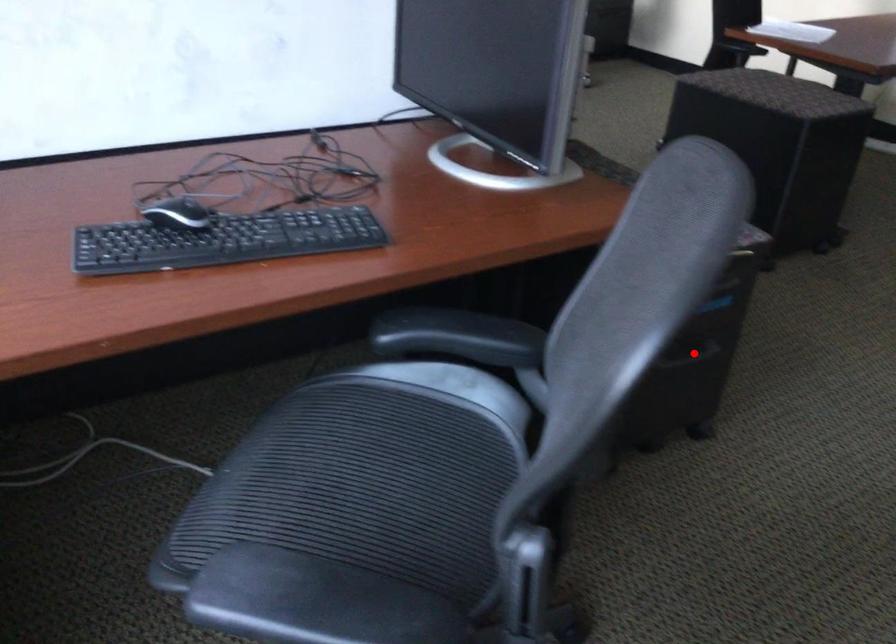
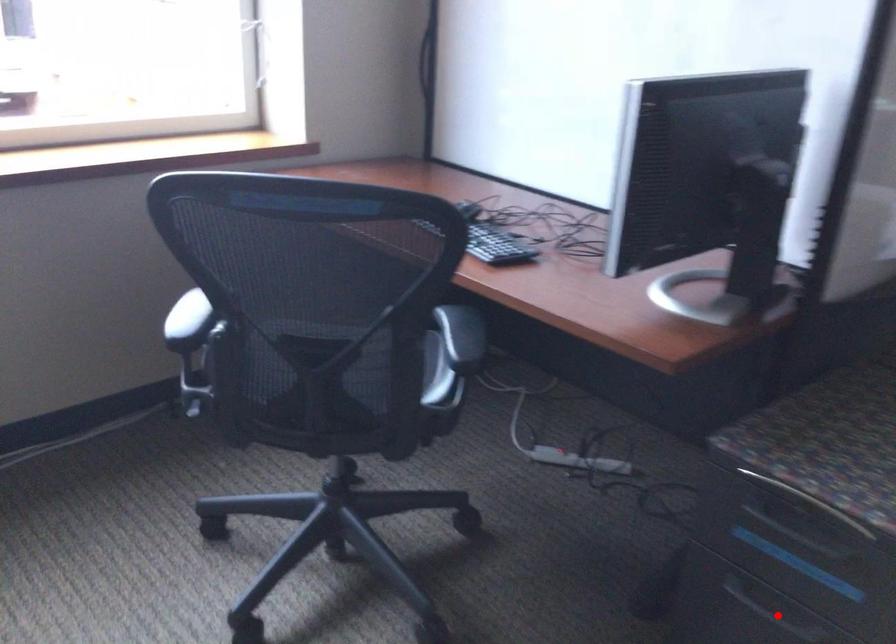
I am providing you with two images of the same scene from different viewpoints. A red point is marked on the first image and another point is marked on the second image. Does the point marked in image1 correspond to the same location as the one in image2?

Yes